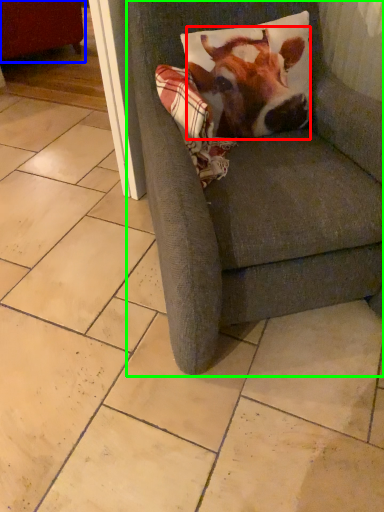
Question: Which object is positioned farthest from cattle (highlighted by a red box)? Select from swivel chair (highlighted by a blue box) and chair (highlighted by a green box).

Choices:
 (A) swivel chair
 (B) chair

Answer: (A)